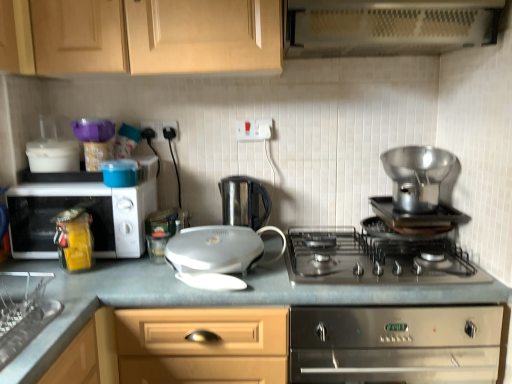
Question: Is white plastic electric outlet at upper center, which is the first electric outlet in left-to-right order, to the left of shiny metallic pot at right, which appears as the first kitchen appliance when viewed from the right, from the viewer's perspective?

Choices:
 (A) no
 (B) yes

Answer: (B)

Question: Is white plastic electric outlet at upper center, which is the second electric outlet in right-to-left order, next to shiny metallic pot at right, the third kitchen appliance from the left?

Choices:
 (A) yes
 (B) no

Answer: (B)

Question: From a real-world perspective, is white plastic electric outlet at upper center, which is the first electric outlet in left-to-right order, located beneath shiny metallic pot at right, which appears as the first kitchen appliance when viewed from the right?

Choices:
 (A) yes
 (B) no

Answer: (B)

Question: Does white plastic electric outlet at upper center, which is the first electric outlet in left-to-right order, lie behind shiny metallic pot at right, the third kitchen appliance from the left?

Choices:
 (A) yes
 (B) no

Answer: (A)

Question: Can you confirm if white plastic electric outlet at upper center, which is the first electric outlet in left-to-right order, is positioned to the right of shiny metallic pot at right, the third kitchen appliance from the left?

Choices:
 (A) yes
 (B) no

Answer: (B)

Question: Is shiny metallic pot at right, which appears as the first kitchen appliance when viewed from the right, completely or partially inside white plastic electric outlet at upper center, which is the second electric outlet in right-to-left order?

Choices:
 (A) yes
 (B) no

Answer: (B)

Question: Is white glossy sandwich maker at center, which ranks as the 1th kitchen appliance in left-to-right order, smaller than yellow plastic container at left?

Choices:
 (A) yes
 (B) no

Answer: (B)

Question: From the image's perspective, would you say white glossy sandwich maker at center, which ranks as the 1th kitchen appliance in left-to-right order, is positioned over yellow plastic container at left?

Choices:
 (A) no
 (B) yes

Answer: (A)

Question: From a real-world perspective, is white glossy sandwich maker at center, which ranks as the 1th kitchen appliance in left-to-right order, located beneath yellow plastic container at left?

Choices:
 (A) yes
 (B) no

Answer: (A)

Question: From the image's perspective, would you say white glossy sandwich maker at center, which ranks as the 1th kitchen appliance in left-to-right order, is shown under yellow plastic container at left?

Choices:
 (A) no
 (B) yes

Answer: (B)

Question: Is white glossy sandwich maker at center, which ranks as the 1th kitchen appliance in left-to-right order, outside of yellow plastic container at left?

Choices:
 (A) no
 (B) yes

Answer: (B)

Question: Is white glossy sandwich maker at center, which ranks as the 1th kitchen appliance in left-to-right order, bigger than yellow plastic container at left?

Choices:
 (A) yes
 (B) no

Answer: (A)

Question: Is matte wood cabinets at upper center not close to white plastic electrical outlet at upper center, which is the first electric outlet from right to left?

Choices:
 (A) no
 (B) yes

Answer: (A)